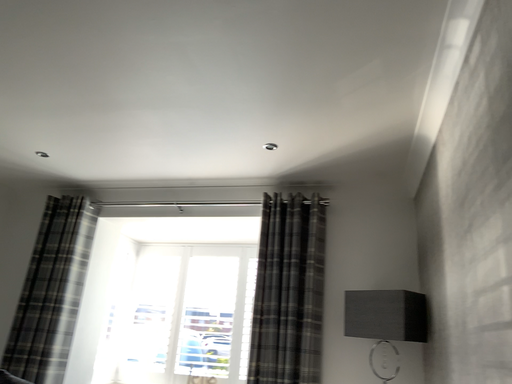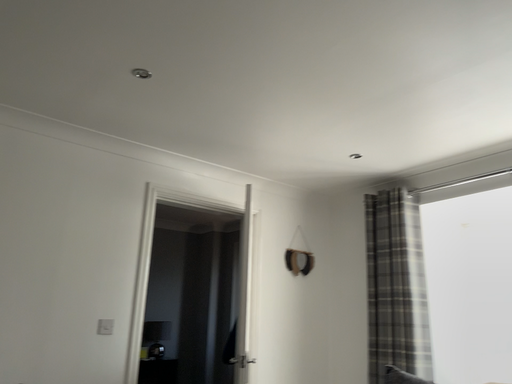
Question: How did the camera likely rotate when shooting the video?

Choices:
 (A) rotated left
 (B) rotated right

Answer: (A)